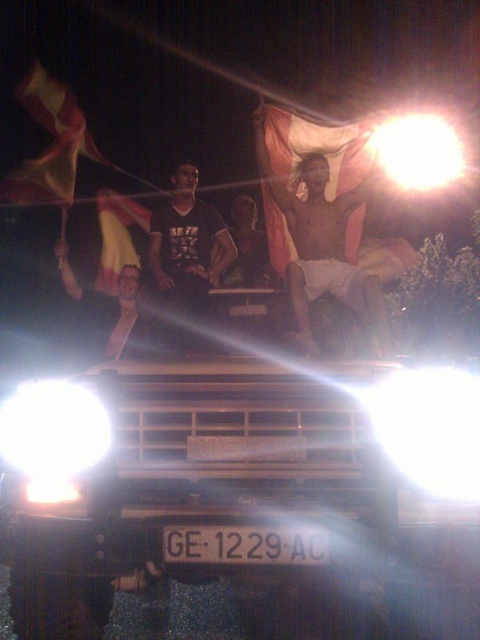
Is shiny metallic man at center bigger than smooth plastic cup at center?

Correct, shiny metallic man at center is larger in size than smooth plastic cup at center.

Is point (330, 268) positioned after point (144, 320)?

Yes, it is behind point (144, 320).

Locate an element on the screen. The image size is (480, 640). shiny metallic man at center is located at coordinates (323, 244).

The image size is (480, 640). What are the coordinates of `shiny metallic man at center` in the screenshot? It's located at (323, 244).

Which is below, shiny metallic man at center or white plastic license plate at center?

white plastic license plate at center is below.

Is point (311, 342) positioned behind point (187, 545)?

Yes, point (311, 342) is farther from viewer.

Locate an element on the screen. This screenshot has height=640, width=480. shiny metallic man at center is located at coordinates click(323, 244).

The width and height of the screenshot is (480, 640). In order to click on shiny metallic man at center in this screenshot , I will do `click(323, 244)`.

Which is more to the right, white plastic license plate at center or smooth plastic cup at center?

white plastic license plate at center

Can you confirm if white plastic license plate at center is positioned below smooth plastic cup at center?

Correct, white plastic license plate at center is located below smooth plastic cup at center.

Does point (262, 529) come in front of point (120, 296)?

That is True.

Identify the location of white plastic license plate at center. (245, 545).